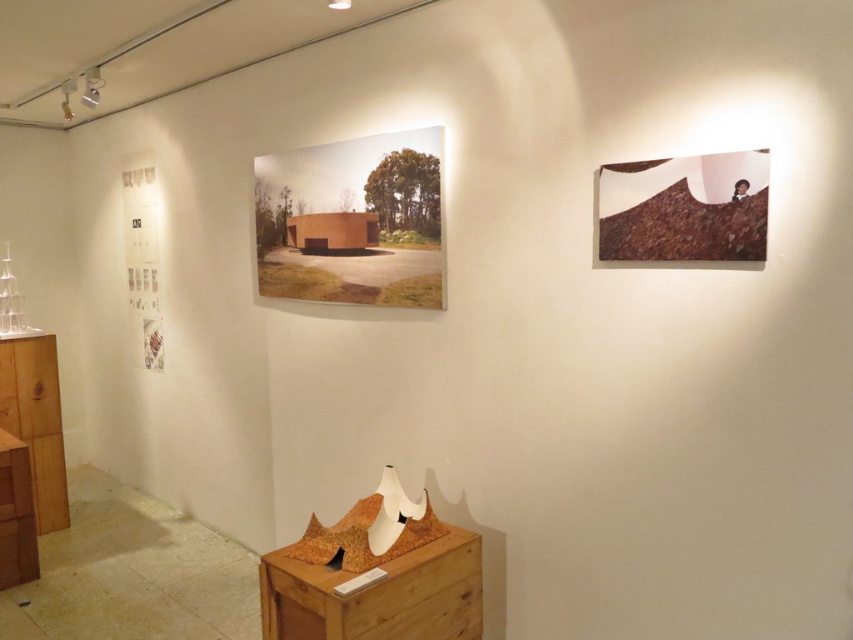
You are an art curator planning to install a new sculpture in the art gallery. You have two wooden dressers available for display purposes. The wooden dresser at lower center and the wooden dresser at left. Which one is closer to the entrance of the gallery?

The wooden dresser at lower center is closer to the entrance of the gallery because it is in front of the wooden dresser at left.

You are an interior designer planning to place a 1.2 meter wide decorative panel. You see the brown textured fabric at upper right and the wooden dresser at lower left. Which object has enough space to accommodate the panel without overlapping?

The wooden dresser at lower left has enough space because its width is greater than the brown textured fabric at upper right, which is insufficient for the 1.2 meter panel.

You are an interior designer assessing the art gallery layout. You need to determine if the brown textured fabric at upper right can be hung higher than the wooden dresser at lower left. Based on their heights, what is your conclusion?

The brown textured fabric at upper right is shorter than the wooden dresser at lower left, so it can be hung higher since its height does not exceed the dresser.